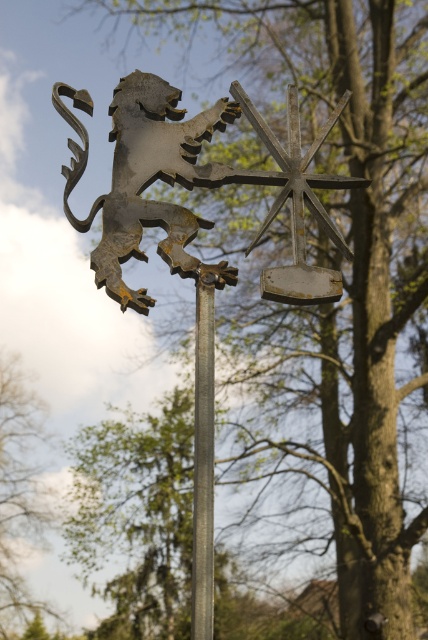
Can you confirm if green leafy tree at lower left is taller than polished metal pole at center?

Yes.

Which is above, green leafy tree at lower left or polished metal pole at center?

polished metal pole at center

Image resolution: width=428 pixels, height=640 pixels. I want to click on green leafy tree at lower left, so pyautogui.click(x=18, y=493).

What do you see at coordinates (143, 177) in the screenshot? The image size is (428, 640). I see `rusty metal lion at upper left` at bounding box center [143, 177].

Which of these two, rusty metal lion at upper left or polished metal pole at center, stands taller?

With more height is polished metal pole at center.

At what (x,y) coordinates should I click in order to perform the action: click on rusty metal lion at upper left. Please return your answer as a coordinate pair (x, y). Looking at the image, I should click on (143, 177).

Can you confirm if rusty metal lion at upper left is positioned to the left of green leafy tree at lower left?

No, rusty metal lion at upper left is not to the left of green leafy tree at lower left.

Is point (115, 132) closer to camera compared to point (38, 492)?

That is True.

Measure the distance between point (116, 172) and camera.

They are 116.76 feet apart.

Locate an element on the screen. Image resolution: width=428 pixels, height=640 pixels. rusty metal lion at upper left is located at coordinates (143, 177).